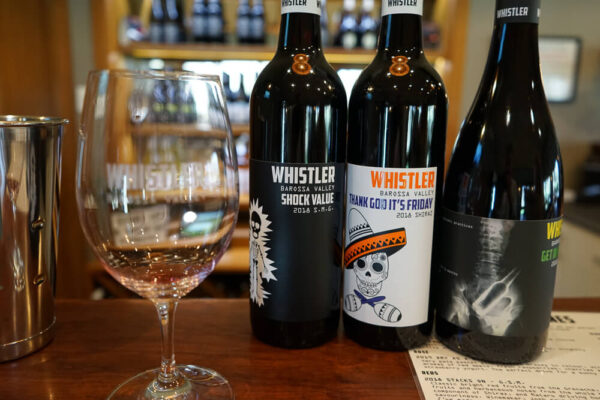
Locate an element on the screen. The width and height of the screenshot is (600, 400). wood table is located at coordinates (288, 377).